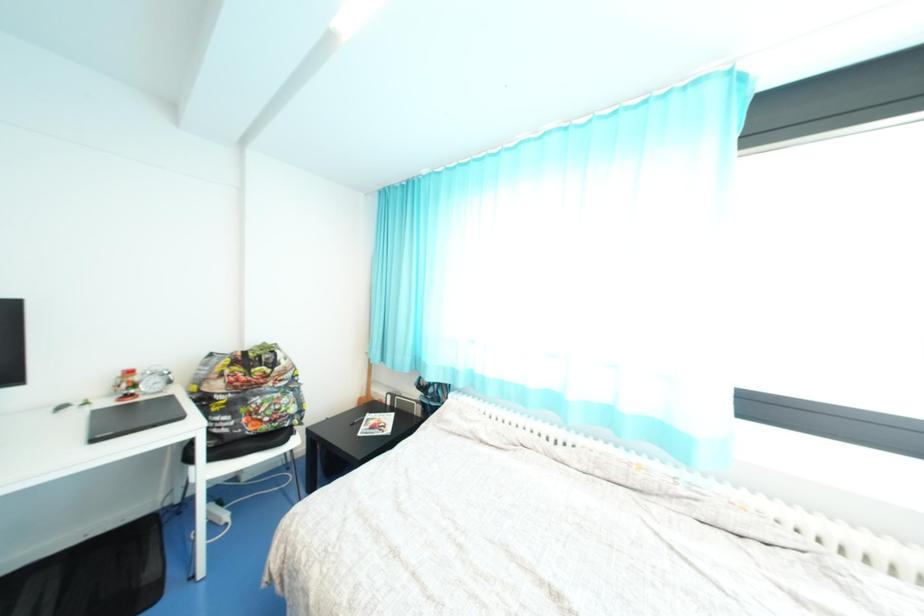
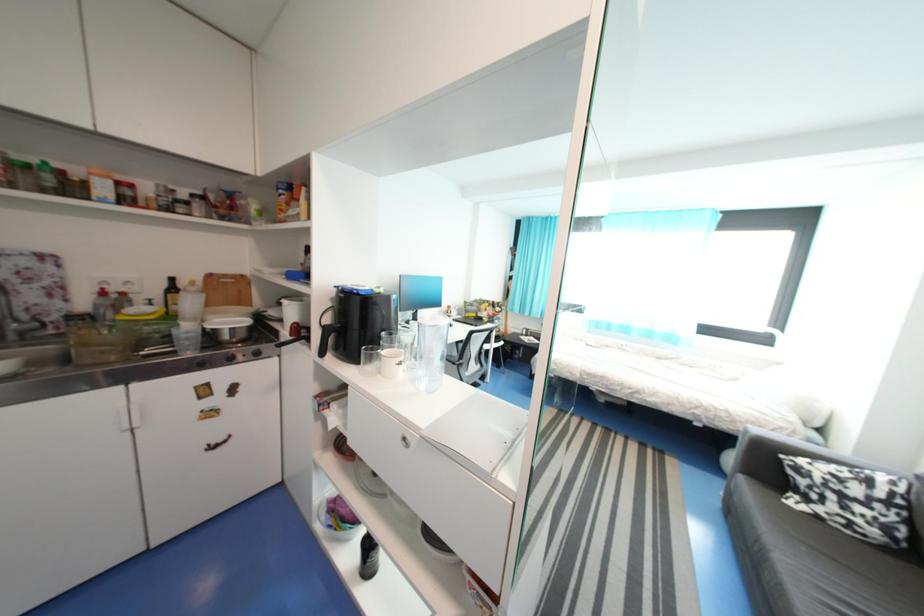
Looking at this image, the images are taken continuously from a first-person perspective. In which direction are you moving?

The cameraman moved toward left, backward.